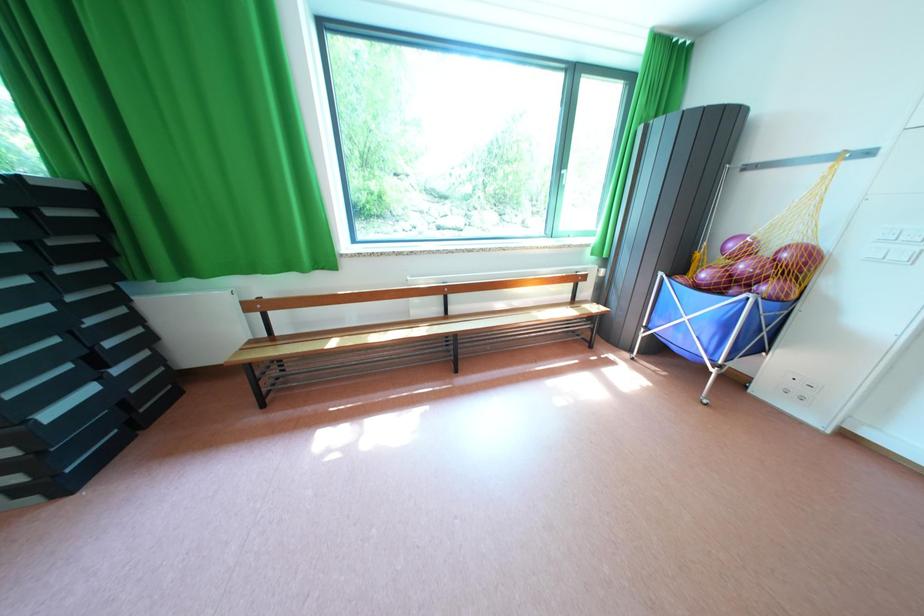
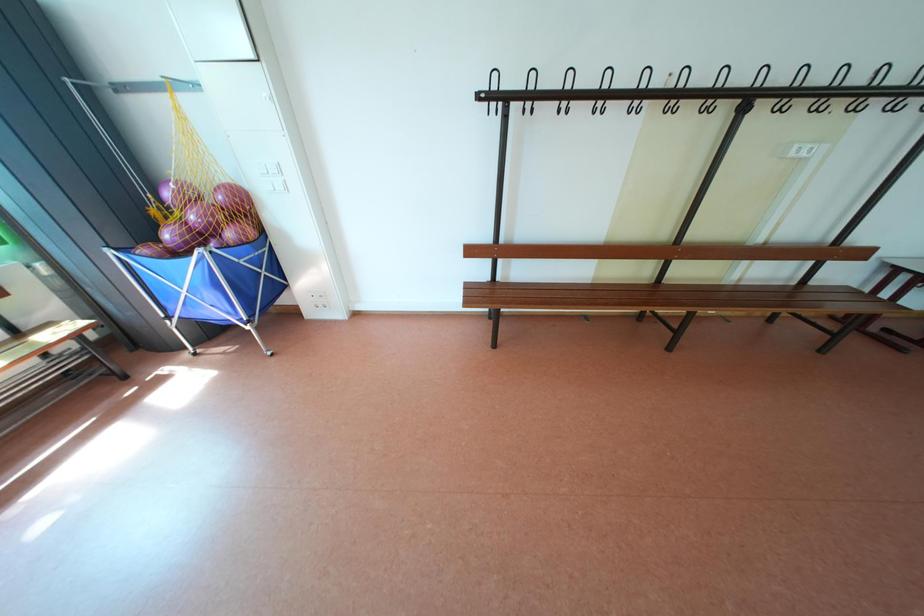
How did the camera likely rotate?

The camera's rotation is toward right-down.